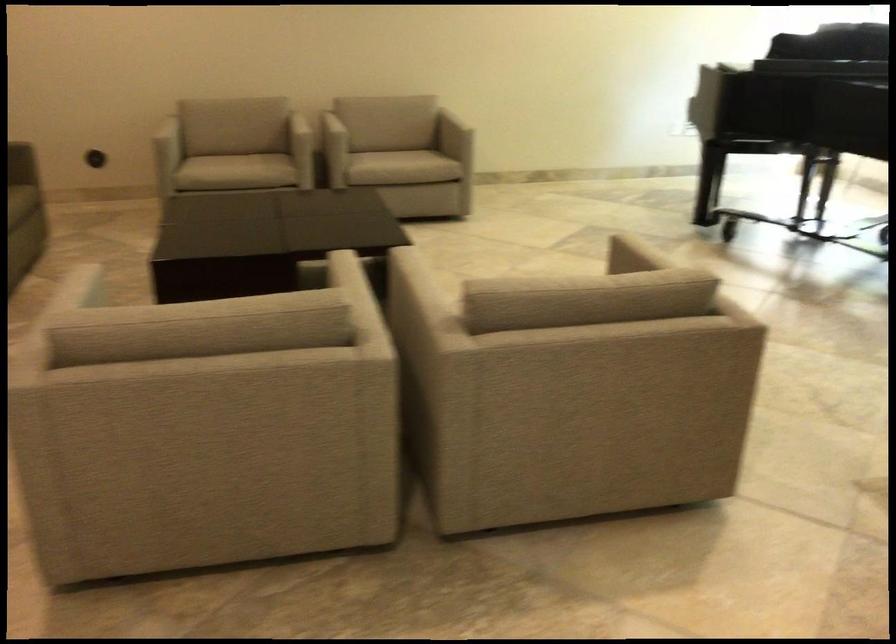
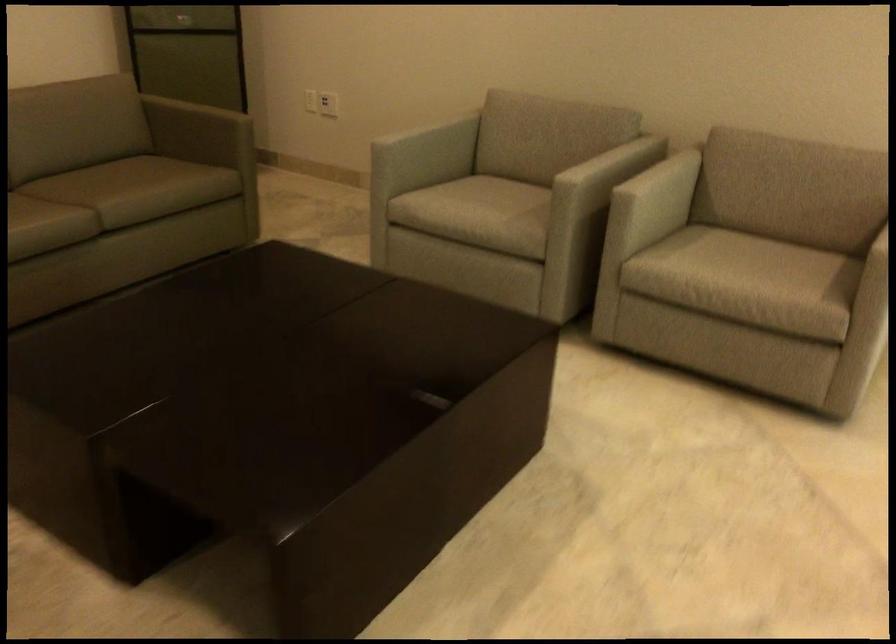
The point at (160, 124) is marked in the first image. Where is the corresponding point in the second image?

(423, 127)